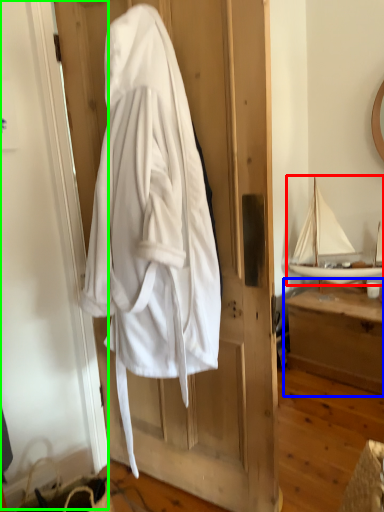
Question: Which object is the closest to the boat (highlighted by a red box)? Choose among these: furniture (highlighted by a blue box) or screen door (highlighted by a green box).

Choices:
 (A) furniture
 (B) screen door

Answer: (A)